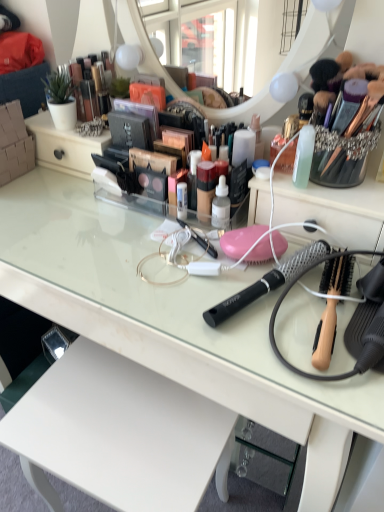
You are a GUI agent. You are given a task and a screenshot of the screen. Output one action in this format:
    pyautogui.click(x=<x>, y=<y>)
    Task: Click on the free point in front of black mesh hairbrush at center, which appears as the second brush when viewed from the right
    
    Given the screenshot: What is the action you would take?
    pyautogui.click(x=287, y=348)